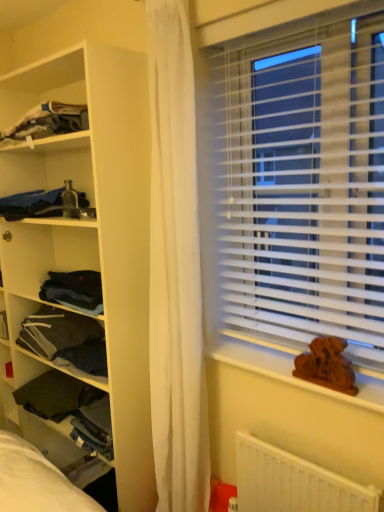
This screenshot has height=512, width=384. I want to click on free spot below white plastic blinds at right (from a real-world perspective), so click(279, 361).